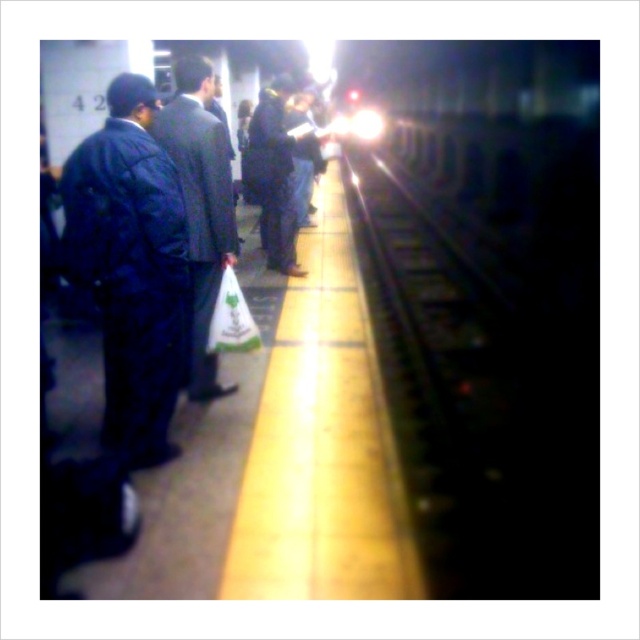
This screenshot has width=640, height=640. I want to click on dark blue jeans at center, so click(x=273, y=173).

Which is behind, point (278, 118) or point (243, 300)?

Point (278, 118)

Where is `dark blue jeans at center`? Image resolution: width=640 pixels, height=640 pixels. dark blue jeans at center is located at coordinates (273, 173).

Find the location of a particular element. dark blue jacket at left is located at coordinates (131, 268).

Is point (179, 332) in front of point (275, 134)?

Yes, it is in front of point (275, 134).

Between point (148, 84) and point (268, 237), which one is positioned behind?

Point (268, 237)

You are a GUI agent. You are given a task and a screenshot of the screen. Output one action in this format:
    pyautogui.click(x=<x>, y=<y>)
    Task: Click on the dark blue jacket at left
    
    Given the screenshot: What is the action you would take?
    pyautogui.click(x=131, y=268)

Does dark blue jacket at left have a greater width compared to white matte shopping bag at center?

Yes.

Locate an element on the screen. The image size is (640, 640). dark blue jacket at left is located at coordinates (131, 268).

Does point (148, 429) come closer to viewer compared to point (234, 275)?

Yes.

The image size is (640, 640). In order to click on dark blue jacket at left in this screenshot , I will do `click(131, 268)`.